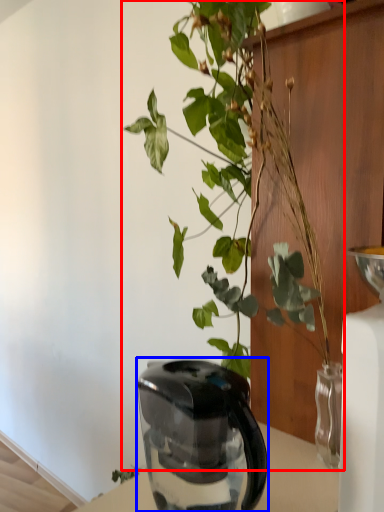
Question: Among these objects, which one is farthest to the camera, houseplant (highlighted by a red box) or kettle (highlighted by a blue box)?

Choices:
 (A) houseplant
 (B) kettle

Answer: (B)